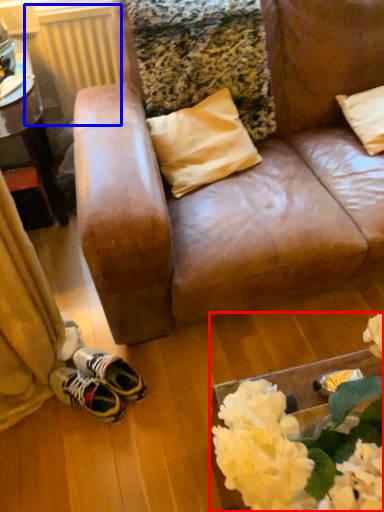
Question: Which point is closer to the camera, floral arrangement (highlighted by a red box) or radiator (highlighted by a blue box)?

Choices:
 (A) floral arrangement
 (B) radiator

Answer: (A)